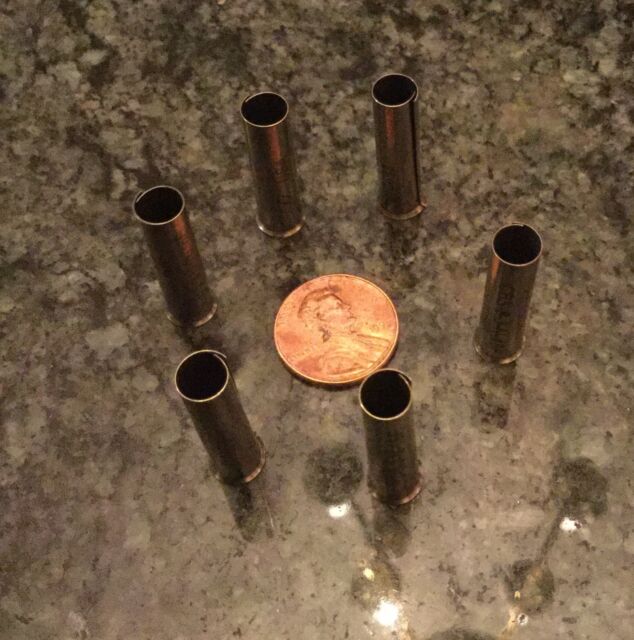
Locate an element on the screen. The height and width of the screenshot is (640, 634). president lincoln's portrait is located at coordinates (333, 324).